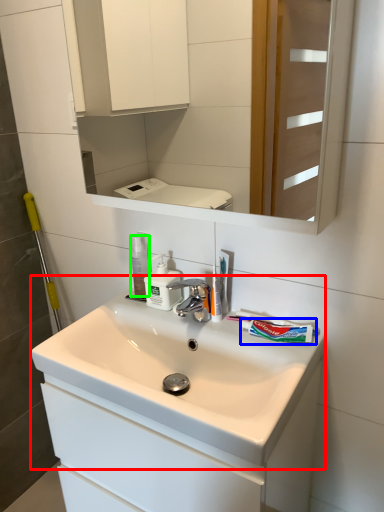
Question: Based on their relative distances, which object is nearer to sink (highlighted by a red box)? Choose from toothpaste (highlighted by a blue box) and mouthwash (highlighted by a green box).

Choices:
 (A) toothpaste
 (B) mouthwash

Answer: (A)